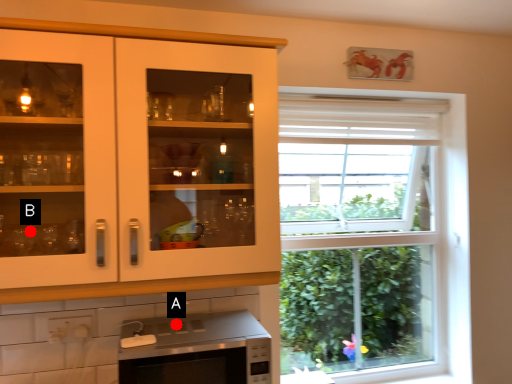
Question: Two points are circled on the image, labeled by A and B beside each circle. Which of the following is the farthest from the observer?

Choices:
 (A) A is further
 (B) B is further

Answer: (A)